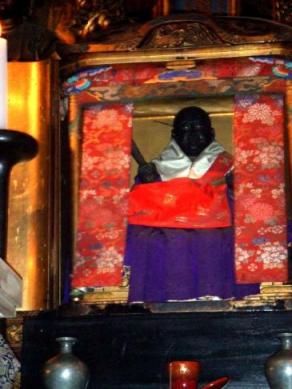
You are a GUI agent. You are given a task and a screenshot of the screen. Output one action in this format:
    pyautogui.click(x=<x>, y=<y>)
    Task: Click on the statue
    
    Given the screenshot: What is the action you would take?
    pyautogui.click(x=198, y=138)